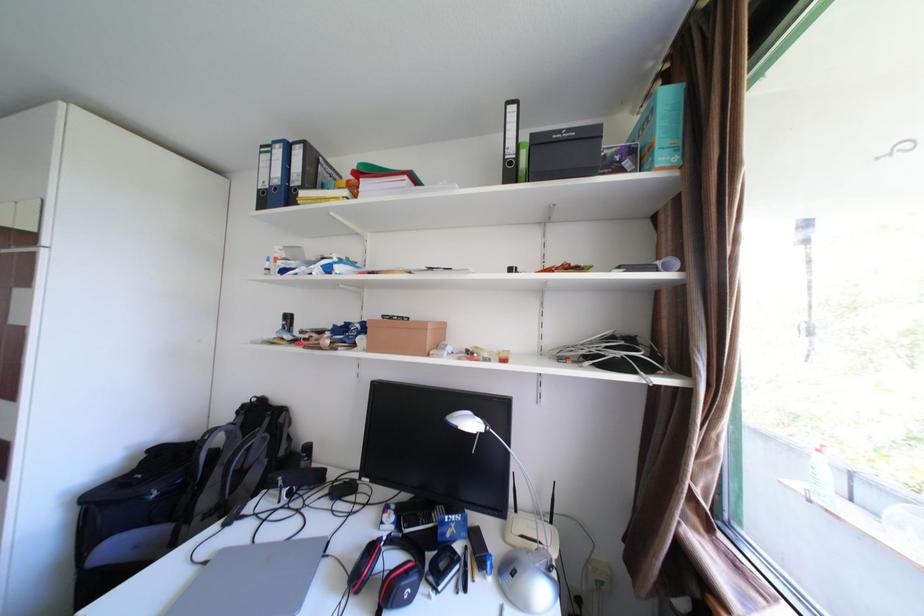
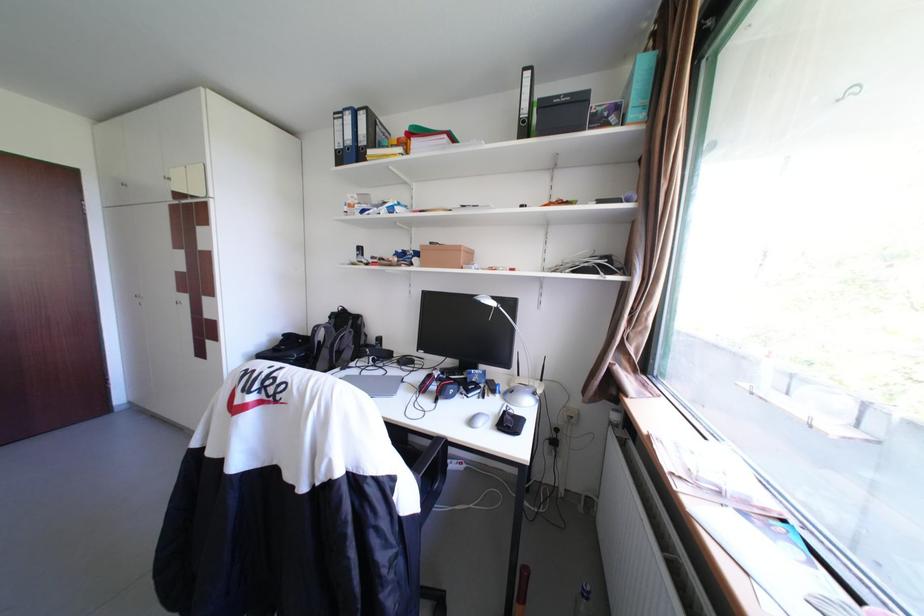
In the second image, find the point that corresponds to point (516, 161) in the first image.

(530, 120)